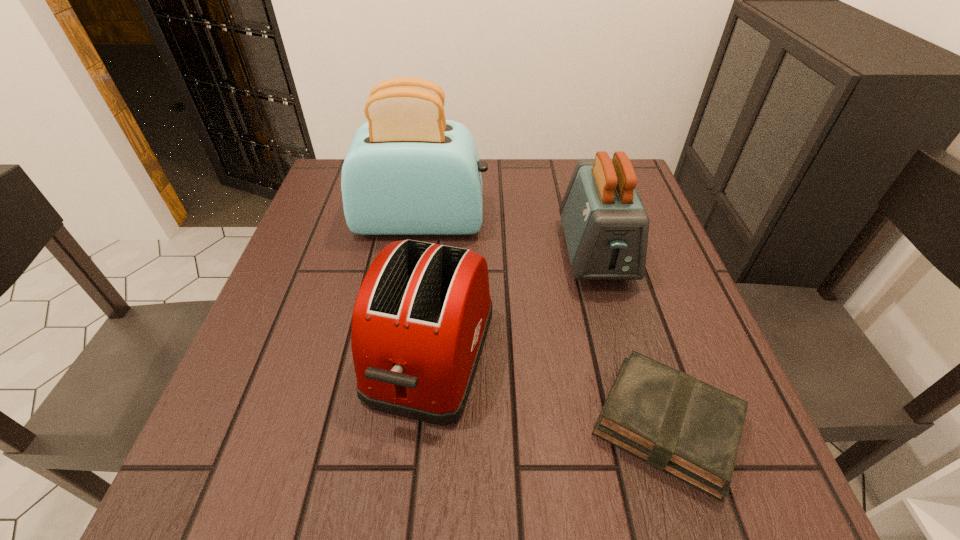
Where is `the tallest toaster`? The image size is (960, 540). the tallest toaster is located at coordinates (409, 171).

I want to click on the rightmost toaster, so click(606, 227).

At what (x,y) coordinates should I click in order to perform the action: click on the nearest toaster. Please return your answer as a coordinate pair (x, y). This screenshot has height=540, width=960. Looking at the image, I should click on (420, 320).

Locate an element on the screen. The height and width of the screenshot is (540, 960). book is located at coordinates (674, 422).

Identify the location of free location located on the side of the tallest toaster with the lever. (597, 222).

Locate an element on the screen. free region located on the front-facing side of the rightmost toaster is located at coordinates (641, 419).

Locate an element on the screen. vacant area situated on the right of the nearest toaster is located at coordinates (576, 355).

Locate an element on the screen. This screenshot has width=960, height=540. free space located 0.380m on the back of the book is located at coordinates (605, 230).

At what (x,y) coordinates should I click in order to perform the action: click on object situated at the far edge. Please return your answer as a coordinate pair (x, y). The image size is (960, 540). Looking at the image, I should click on (409, 171).

Find the location of a particular element. This screenshot has height=540, width=960. object that is at the near edge is located at coordinates click(674, 422).